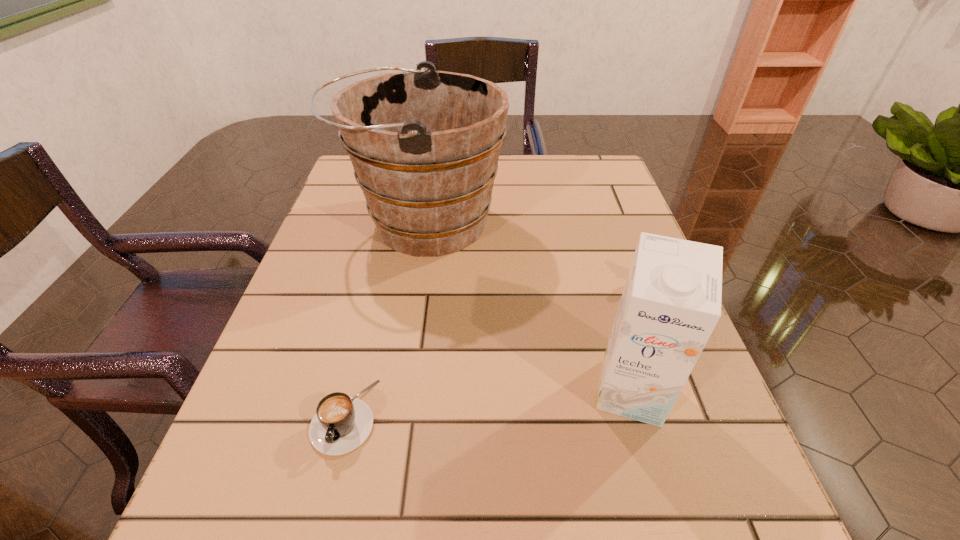
The height and width of the screenshot is (540, 960). In order to click on unoccupied area between the rightmost object and the cappuccino in this screenshot , I will do `click(488, 404)`.

The image size is (960, 540). What are the coordinates of `object that stands as the second closest to the bucket` in the screenshot? It's located at (341, 424).

Select which object is the second closest to the farthest object. Please provide its 2D coordinates. Your answer should be formatted as a tuple, i.e. [(x, y)], where the tuple contains the x and y coordinates of a point satisfying the conditions above.

[(341, 424)]